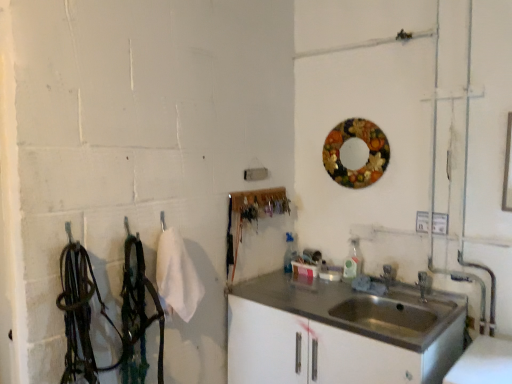
Image resolution: width=512 pixels, height=384 pixels. Find the location of `satin silver faucet at sink right`. satin silver faucet at sink right is located at coordinates (388, 275).

In the scene shown: Is satin white cabinet at lower right wider or thinner than satin silver faucet at sink right?

Clearly, satin white cabinet at lower right has more width compared to satin silver faucet at sink right.

From the image's perspective, relative to satin silver faucet at sink right, is satin white cabinet at lower right above or below?

Based on their image positions, satin white cabinet at lower right is located beneath satin silver faucet at sink right.

In the scene shown: Considering the positions of objects satin white cabinet at lower right and satin silver faucet at sink right in the image provided, who is more to the left, satin white cabinet at lower right or satin silver faucet at sink right?

Positioned to the left is satin white cabinet at lower right.

Could you tell me if satin white cabinet at lower right is facing satin silver faucet at sink right?

No, satin white cabinet at lower right is not turned towards satin silver faucet at sink right.

From a real-world perspective, who is located lower, wooden circular mirror at upper right or satin silver faucet at sink right?

satin silver faucet at sink right, from a real-world perspective.

Is wooden circular mirror at upper right oriented away from satin silver faucet at sink right?

No, wooden circular mirror at upper right is not facing the opposite direction of satin silver faucet at sink right.

Which object is more forward, wooden circular mirror at upper right or satin silver faucet at sink right?

wooden circular mirror at upper right.

Is point (336, 162) closer or farther from the camera than point (383, 271)?

Point (336, 162).

From a real-world perspective, does satin silver faucet at sink right sit lower than satin white cabinet at lower right?

No.

Would you consider satin silver faucet at sink right to be distant from satin white cabinet at lower right?

They are positioned close to each other.

Considering the sizes of satin silver faucet at sink right and satin white cabinet at lower right in the image, is satin silver faucet at sink right bigger or smaller than satin white cabinet at lower right?

Considering their sizes, satin silver faucet at sink right takes up less space than satin white cabinet at lower right.

Between satin silver faucet at sink right and wooden circular mirror at upper right, which one has smaller width?

With smaller width is wooden circular mirror at upper right.

From a real-world perspective, who is located lower, satin silver faucet at sink right or wooden circular mirror at upper right?

satin silver faucet at sink right, from a real-world perspective.

Is satin silver faucet at sink right far away from wooden circular mirror at upper right?

No, satin silver faucet at sink right is not far from wooden circular mirror at upper right.

From a real-world perspective, is wooden circular mirror at upper right over satin white cabinet at lower right?

Yes, from a real-world perspective, wooden circular mirror at upper right is over satin white cabinet at lower right

Looking at the image, does wooden circular mirror at upper right seem bigger or smaller compared to satin white cabinet at lower right?

wooden circular mirror at upper right is smaller than satin white cabinet at lower right.

Is satin white cabinet at lower right inside wooden circular mirror at upper right?

Definitely not — satin white cabinet at lower right is not inside wooden circular mirror at upper right.

Is wooden circular mirror at upper right facing towards satin white cabinet at lower right?

No, wooden circular mirror at upper right is not facing towards satin white cabinet at lower right.

Looking at this image, in the image, is satin white cabinet at lower right positioned in front of or behind wooden circular mirror at upper right?

Clearly, satin white cabinet at lower right is in front of wooden circular mirror at upper right.

From the image's perspective, is satin white cabinet at lower right over wooden circular mirror at upper right?

No, from the image's perspective, satin white cabinet at lower right is not on top of wooden circular mirror at upper right.

Considering the relative sizes of satin white cabinet at lower right and wooden circular mirror at upper right in the image provided, is satin white cabinet at lower right smaller than wooden circular mirror at upper right?

Incorrect, satin white cabinet at lower right is not smaller in size than wooden circular mirror at upper right.

Where is `bathroom cabinet lying below the satin silver faucet at sink right (from the image's perspective)`? bathroom cabinet lying below the satin silver faucet at sink right (from the image's perspective) is located at coordinates (327, 350).

The image size is (512, 384). In order to click on mirror that is above the satin silver faucet at sink right (from a real-world perspective) in this screenshot , I will do `click(362, 141)`.

From the picture: Looking at the image, which one is located closer to wooden circular mirror at upper right, satin silver faucet at sink right or satin white cabinet at lower right?

The object closer to wooden circular mirror at upper right is satin silver faucet at sink right.

Looking at the image, which one is located closer to satin white cabinet at lower right, satin silver faucet at sink right or wooden circular mirror at upper right?

satin silver faucet at sink right.

When comparing their distances from satin white cabinet at lower right, does wooden circular mirror at upper right or satin silver faucet at sink right seem further?

wooden circular mirror at upper right is further to satin white cabinet at lower right.

Considering their positions, is satin white cabinet at lower right positioned closer to wooden circular mirror at upper right than satin silver faucet at sink right?

Based on the image, satin silver faucet at sink right appears to be nearer to wooden circular mirror at upper right.

From the image, which object appears to be farther from satin silver faucet at sink right, satin white cabinet at lower right or wooden circular mirror at upper right?

Among the two, wooden circular mirror at upper right is located further to satin silver faucet at sink right.

Estimate the real-world distances between objects in this image. Which object is further from satin silver faucet at sink right, wooden circular mirror at upper right or satin white cabinet at lower right?

wooden circular mirror at upper right is positioned further to the anchor satin silver faucet at sink right.

This screenshot has height=384, width=512. Find the location of `faucet that lies between wooden circular mirror at upper right and satin white cabinet at lower right from top to bottom`. faucet that lies between wooden circular mirror at upper right and satin white cabinet at lower right from top to bottom is located at coordinates (388, 275).